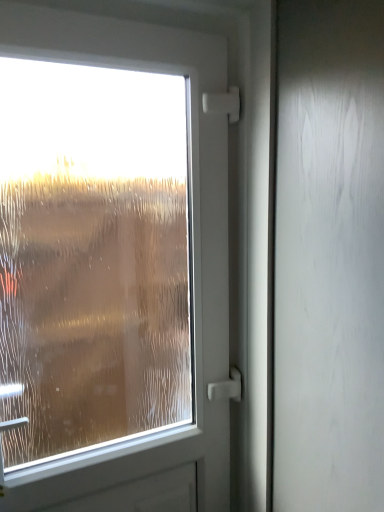
Question: From a real-world perspective, does frosted glass window at left sit lower than satin white screen door at right?

Choices:
 (A) no
 (B) yes

Answer: (B)

Question: Does frosted glass window at left lie behind satin white screen door at right?

Choices:
 (A) no
 (B) yes

Answer: (B)

Question: Is frosted glass window at left not close to satin white screen door at right?

Choices:
 (A) yes
 (B) no

Answer: (A)

Question: Considering the relative positions of frosted glass window at left and satin white screen door at right in the image provided, is frosted glass window at left to the right of satin white screen door at right from the viewer's perspective?

Choices:
 (A) yes
 (B) no

Answer: (B)

Question: Does frosted glass window at left have a lesser height compared to satin white screen door at right?

Choices:
 (A) no
 (B) yes

Answer: (B)

Question: Can you confirm if frosted glass window at left is bigger than satin white screen door at right?

Choices:
 (A) yes
 (B) no

Answer: (B)

Question: Is there a large distance between satin white screen door at right and frosted glass window at left?

Choices:
 (A) no
 (B) yes

Answer: (B)

Question: From a real-world perspective, is satin white screen door at right on frosted glass window at left?

Choices:
 (A) yes
 (B) no

Answer: (A)

Question: Is satin white screen door at right at the right side of frosted glass window at left?

Choices:
 (A) no
 (B) yes

Answer: (B)

Question: Is satin white screen door at right aimed at frosted glass window at left?

Choices:
 (A) yes
 (B) no

Answer: (B)

Question: Is satin white screen door at right bigger than frosted glass window at left?

Choices:
 (A) no
 (B) yes

Answer: (B)

Question: Would you say frosted glass window at left is part of satin white screen door at right's contents?

Choices:
 (A) yes
 (B) no

Answer: (B)

Question: Is satin white screen door at right inside or outside of frosted glass window at left?

Choices:
 (A) inside
 (B) outside

Answer: (B)